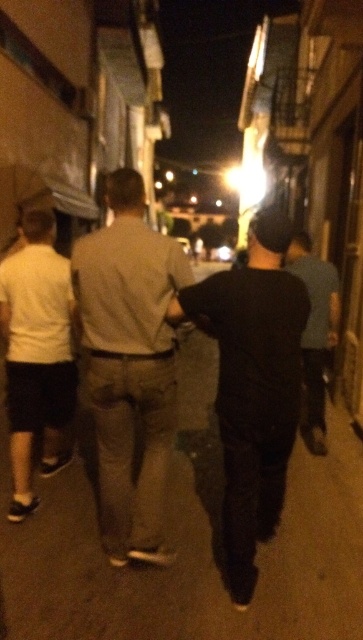
You are standing at the starting point in the alleyway scene. There are two points marked on the ground ahead of you. The first point is at coordinates point (292, 600) and the second is at point (15, 285). Which point is closer to you?

The point at (292, 600) is closer to you because it is in front of the other point.